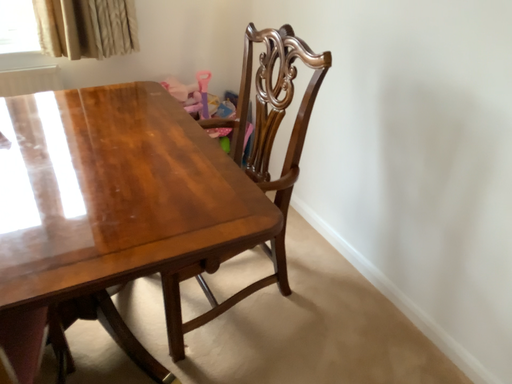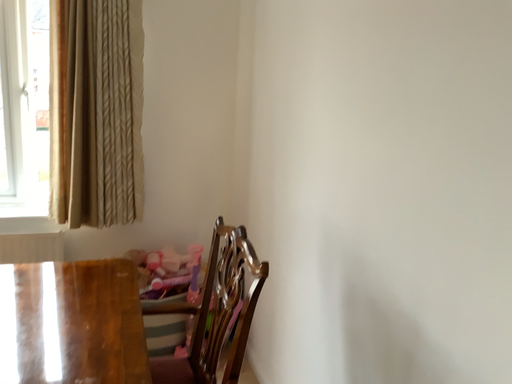
Question: How did the camera likely rotate when shooting the video?

Choices:
 (A) rotated downward
 (B) rotated upward

Answer: (B)